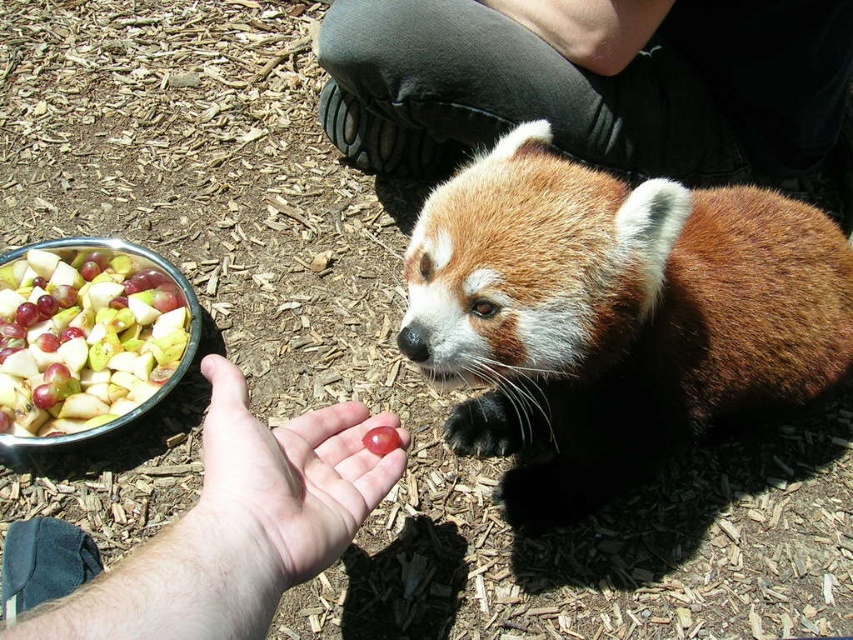
Which of these two, brown fuzzy red panda at center or smooth skin palm at center, stands shorter?

smooth skin palm at center

Is point (537, 474) closer to camera compared to point (300, 579)?

No.

Which is behind, point (473, 320) or point (271, 472)?

The point (473, 320) is behind.

I want to click on brown fuzzy red panda at center, so click(x=613, y=314).

Is pink skin palm at center below smooth skin palm at center?

Correct, pink skin palm at center is located below smooth skin palm at center.

Who is positioned more to the right, pink skin palm at center or smooth skin palm at center?

From the viewer's perspective, smooth skin palm at center appears more on the right side.

You are a GUI agent. You are given a task and a screenshot of the screen. Output one action in this format:
    pyautogui.click(x=<x>, y=<y>)
    Task: Click on the pink skin palm at center
    This screenshot has height=640, width=853.
    Given the screenshot: What is the action you would take?
    pyautogui.click(x=236, y=525)

Is point (178, 307) farther from viewer compared to point (329, 492)?

Yes, it is.

At what (x,y) coordinates should I click in order to perform the action: click on shiny plastic bowl of mixed fruit at lower left. Please return your answer as a coordinate pair (x, y). Looking at the image, I should click on (88, 337).